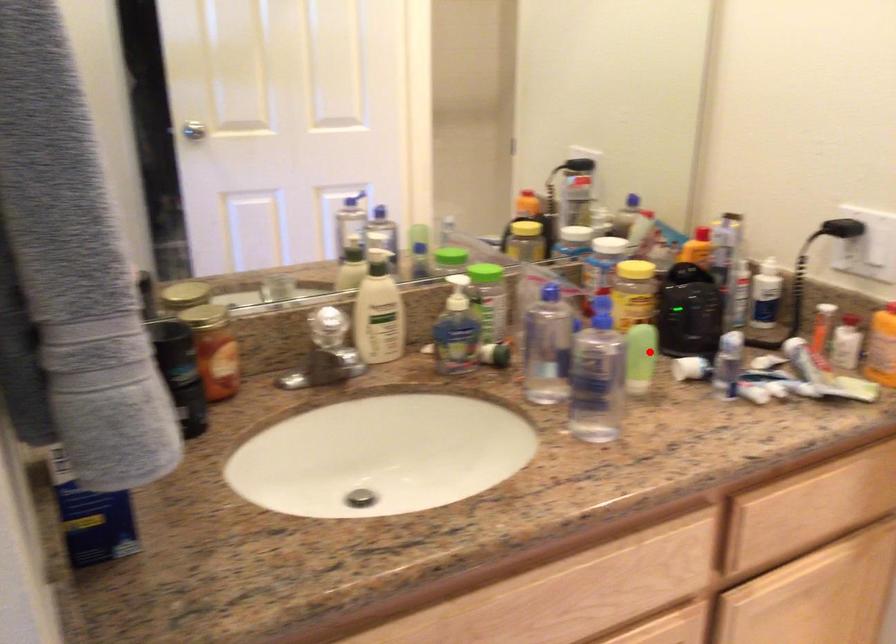
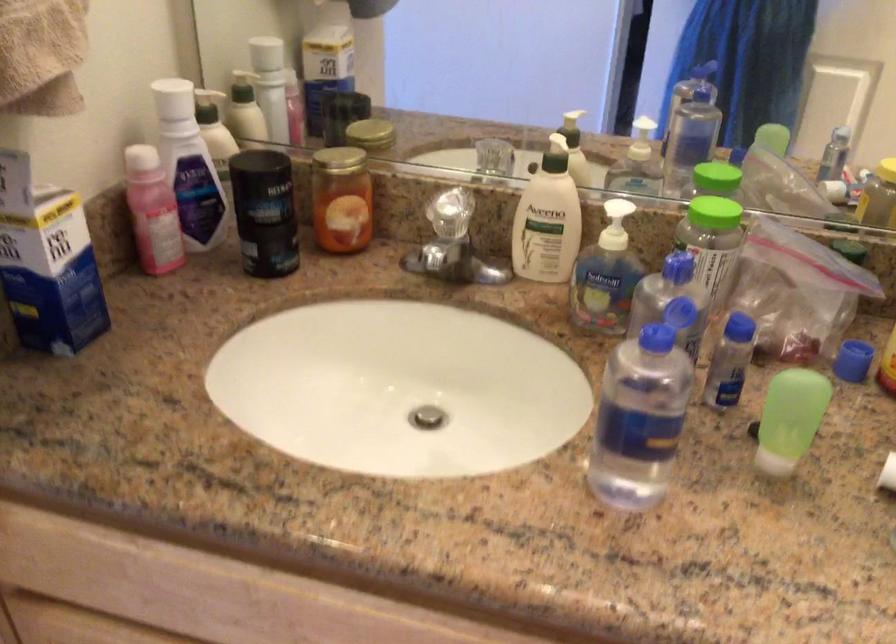
Question: I am providing you with two images of the same scene from different viewpoints. Given a red point in image1, look at the same physical point in image2. Is it:

Choices:
 (A) Closer to the viewpoint
 (B) Farther from the viewpoint

Answer: (A)